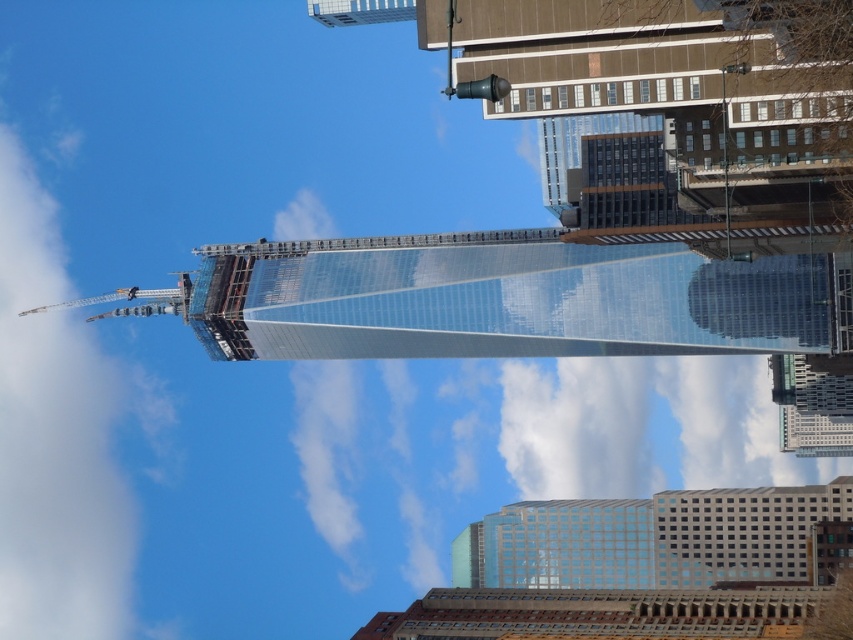
You are a city planner reviewing a construction blueprint. The blueprint shows a point at coordinates (764, 298). Based on the image provided, what does this point indicate?

The point at coordinates (764, 298) marks the transparent glass building at right.

You are standing at the point marked by the coordinates point (x=743, y=532) in the image. What object are you facing in the scene?

The point (x=743, y=532) marks the white glass building at lower right, so you are facing the white glass building at lower right.

You are an architect reviewing the cityscape. You need to determine which object is taller between the white glass building at lower right and the metallic silver crane at upper left. Based on the scene, which one is taller?

The white glass building at lower right has a greater height compared to the metallic silver crane at upper left, so the white glass building at lower right is taller.